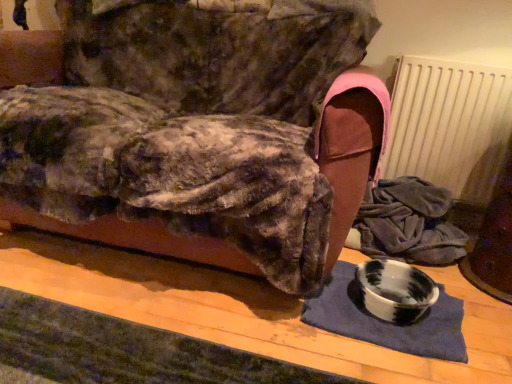
Question: From a real-world perspective, is marble bowl at lower right below white matte radiator at upper right?

Choices:
 (A) no
 (B) yes

Answer: (A)

Question: Is white matte radiator at upper right completely or partially inside marble bowl at lower right?

Choices:
 (A) yes
 (B) no

Answer: (B)

Question: Can you see marble bowl at lower right touching white matte radiator at upper right?

Choices:
 (A) yes
 (B) no

Answer: (B)

Question: Is marble bowl at lower right to the left of white matte radiator at upper right from the viewer's perspective?

Choices:
 (A) no
 (B) yes

Answer: (B)

Question: From a real-world perspective, is marble bowl at lower right on top of white matte radiator at upper right?

Choices:
 (A) no
 (B) yes

Answer: (B)

Question: Considering the relative positions of marble bowl at lower right and white matte radiator at upper right in the image provided, is marble bowl at lower right behind white matte radiator at upper right?

Choices:
 (A) no
 (B) yes

Answer: (A)

Question: Is white matte radiator at upper right a part of marbled ceramic bowl at lower right?

Choices:
 (A) yes
 (B) no

Answer: (B)

Question: From the image's perspective, would you say marbled ceramic bowl at lower right is shown under white matte radiator at upper right?

Choices:
 (A) yes
 (B) no

Answer: (A)

Question: From a real-world perspective, is marbled ceramic bowl at lower right beneath white matte radiator at upper right?

Choices:
 (A) no
 (B) yes

Answer: (B)

Question: Is marbled ceramic bowl at lower right wider than white matte radiator at upper right?

Choices:
 (A) no
 (B) yes

Answer: (B)

Question: Could you tell me if marbled ceramic bowl at lower right is turned towards white matte radiator at upper right?

Choices:
 (A) yes
 (B) no

Answer: (B)

Question: Considering the relative positions of marbled ceramic bowl at lower right and white matte radiator at upper right in the image provided, is marbled ceramic bowl at lower right to the right of white matte radiator at upper right from the viewer's perspective?

Choices:
 (A) no
 (B) yes

Answer: (A)

Question: Is marbled ceramic bowl at lower right closer to the viewer compared to marble bowl at lower right?

Choices:
 (A) yes
 (B) no

Answer: (B)